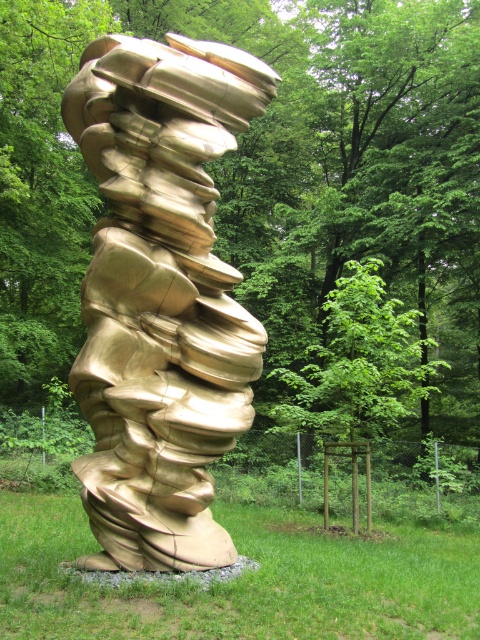
You are standing in front of the sculpture and want to take a photo of it with your phone. Your phone has a maximum focus distance of 5 meters. Will the gold metallic sculpture at center be in focus?

The gold metallic sculpture at center is 5.16 meters away from camera, which exceeds the phone camera maximum focus distance of 5 meters. Therefore, the sculpture will not be in focus.

You are standing in front of the sculpture and want to take a photo of the green leafy tree at center and the green grass at lower center. Which object will appear larger in the photo?

The green leafy tree at center will appear larger in the photo because it is closer to the viewer than the green grass at lower center.

You are a photographer trying to capture both the green leafy tree at center and the gold metallic sculpture at center in a single frame. Based on their widths, which object should you position closer to the camera to ensure both fit in the shot?

The green leafy tree at center might be wider than the gold metallic sculpture at center, so positioning the tree closer to the camera would help ensure both fit in the frame since wider objects appear larger when closer.